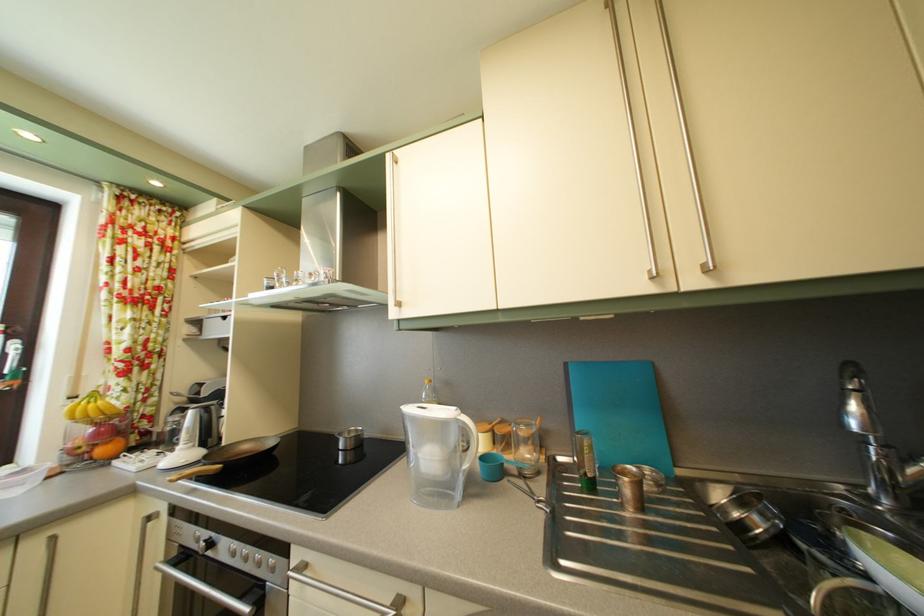
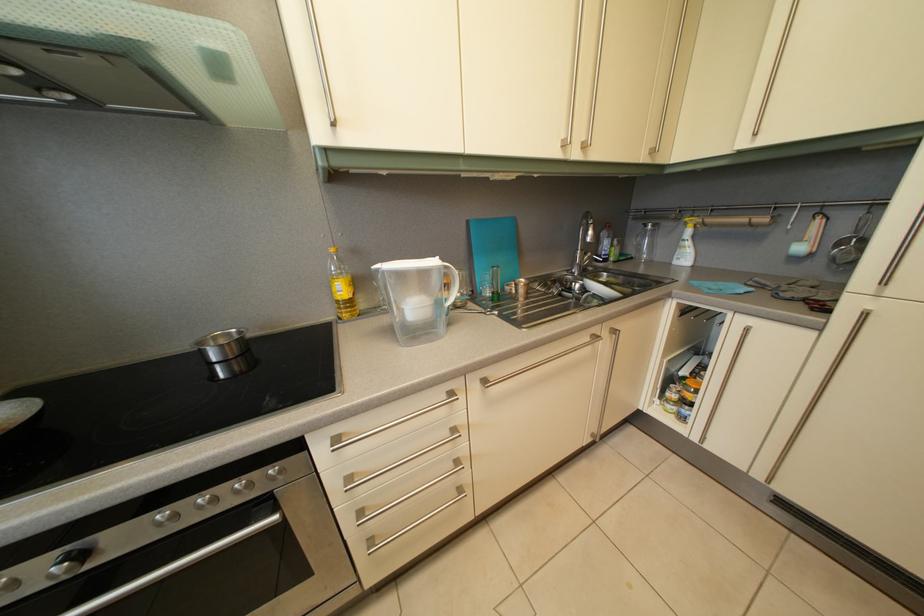
Where in the second image is the point corresponding to point 208,540 from the first image?

(8, 586)